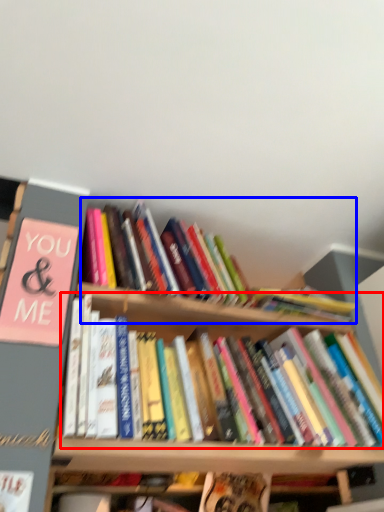
Question: Which object is closer to the camera taking this photo, book (highlighted by a red box) or book (highlighted by a blue box)?

Choices:
 (A) book
 (B) book

Answer: (A)